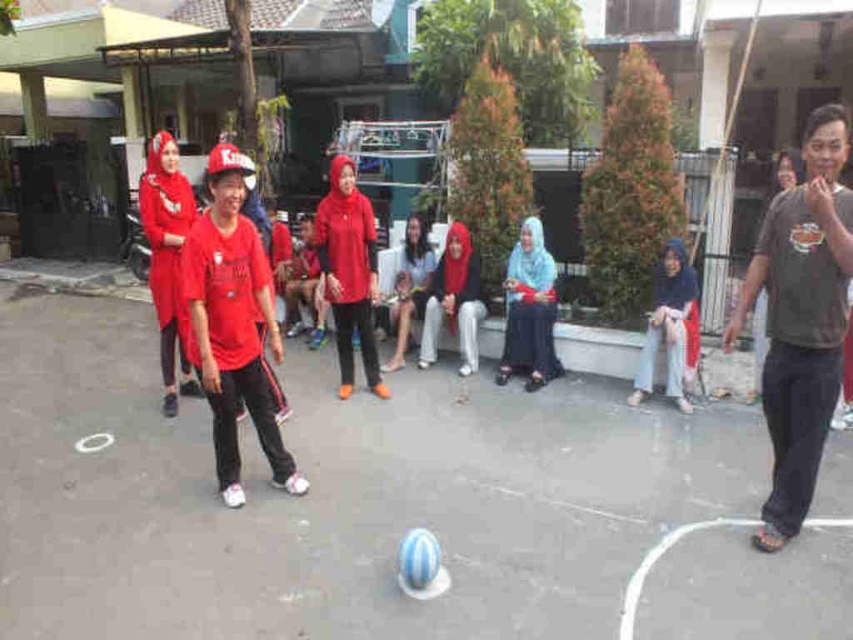
Consider the image. You are standing at the origin point of the image coordinate system. You see a dark gray t shirt at right located at point (801, 317). If you walk straight ahead, will you reach the dark gray t shirt at right before reaching the edge of the image?

The dark gray t shirt at right is located at point (801, 317). Since the coordinate system origin is at the bottom left corner, the y coordinate 0.940 indicates it is near the bottom of the image. Walking straight ahead from the origin would mean moving upward along the y axis. The edge of the image at the top is at y coordinate 1.0. Since 0.940 is very close to 1.0, you would reach the dark gray t shirt at right just before reaching the top edge of the image.